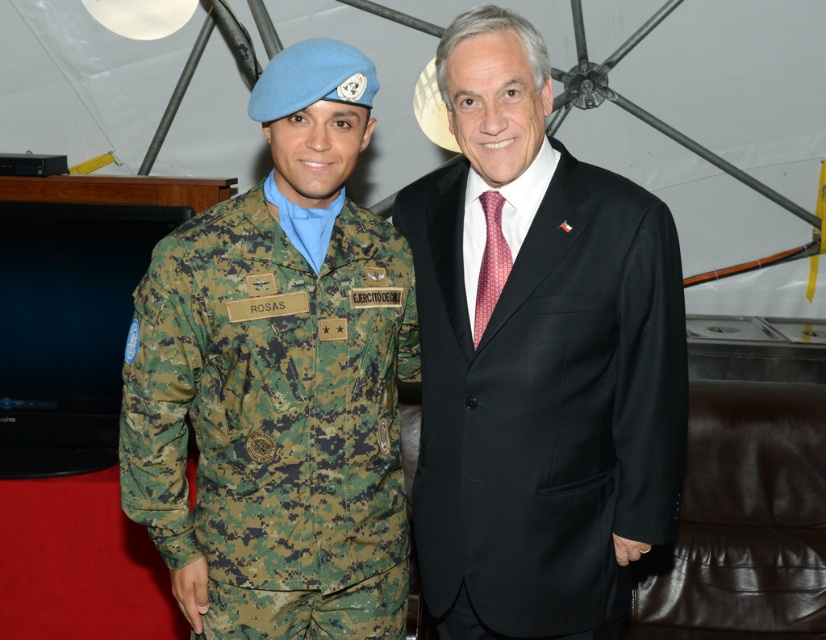
Question: Which object appears farthest from the camera in this image?

Choices:
 (A) black satin suit at center
 (B) red dotted fabric tie at center
 (C) camouflagetextured fabric at left

Answer: (B)

Question: Does camouflagetextured fabric at left have a smaller size compared to red dotted fabric tie at center?

Choices:
 (A) yes
 (B) no

Answer: (B)

Question: Which point is closer to the camera?

Choices:
 (A) (489, 198)
 (B) (393, 326)

Answer: (A)

Question: Can you confirm if camouflagetextured fabric at left is wider than red dotted fabric tie at center?

Choices:
 (A) no
 (B) yes

Answer: (B)

Question: Which of the following is the farthest from the observer?

Choices:
 (A) camouflagetextured fabric at left
 (B) red dotted fabric tie at center

Answer: (B)

Question: Does black satin suit at center have a greater width compared to camouflagetextured fabric at left?

Choices:
 (A) yes
 (B) no

Answer: (A)